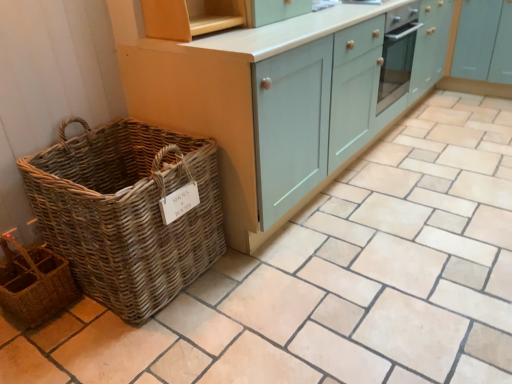
Identify the location of vacant space that's between woven brown basket at left and rustic wicker basket at lower left. (86, 328).